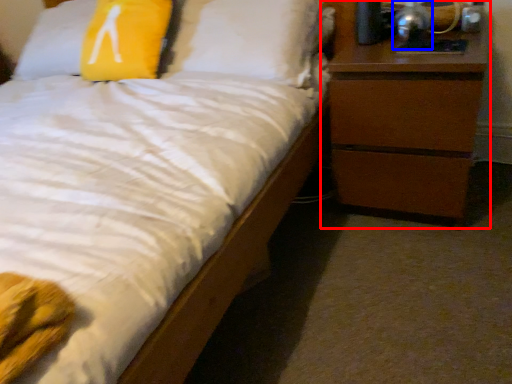
Question: Among these objects, which one is farthest to the camera, chest of drawers (highlighted by a red box) or bedside lamp (highlighted by a blue box)?

Choices:
 (A) chest of drawers
 (B) bedside lamp

Answer: (B)